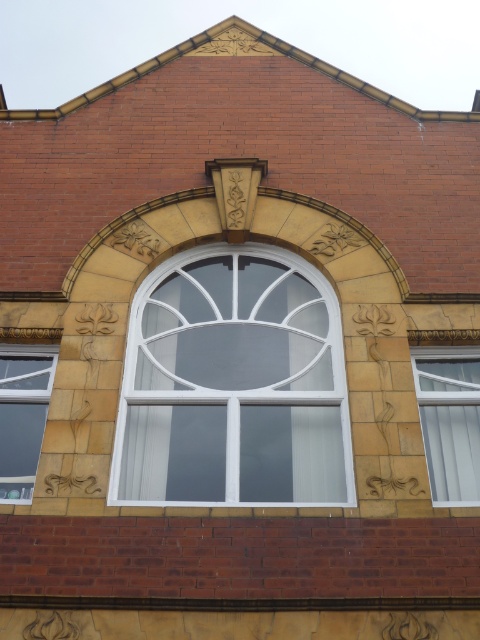
Question: Which point is farther to the camera?

Choices:
 (A) white plastic window at right
 (B) white glass window at center
 (C) clear glass window at lower left

Answer: (A)

Question: Is white glass window at center bigger than clear glass window at lower left?

Choices:
 (A) no
 (B) yes

Answer: (B)

Question: Is white glass window at center above clear glass window at lower left?

Choices:
 (A) no
 (B) yes

Answer: (B)

Question: Which point is farther to the camera?

Choices:
 (A) (21, 410)
 (B) (456, 440)

Answer: (A)

Question: Is white plastic window at right to the left of clear glass window at lower left from the viewer's perspective?

Choices:
 (A) yes
 (B) no

Answer: (B)

Question: Which point appears closest to the camera in this image?

Choices:
 (A) (26, 472)
 (B) (436, 460)
 (C) (178, 413)

Answer: (A)